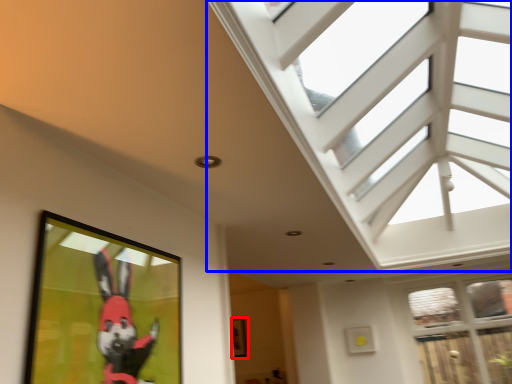
Question: Which of the following is the closest to the observer, picture frame (highlighted by a red box) or window (highlighted by a blue box)?

Choices:
 (A) picture frame
 (B) window

Answer: (B)